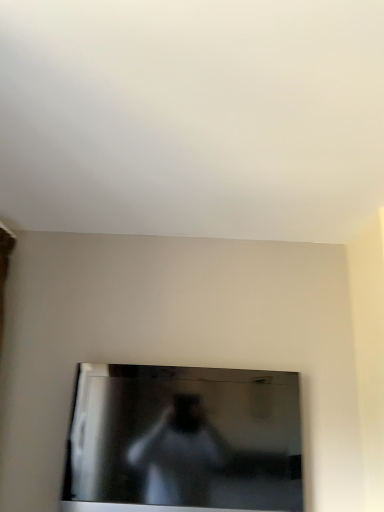
Question: Should I look upward or downward to see black glossy tv at center?

Choices:
 (A) down
 (B) up

Answer: (A)